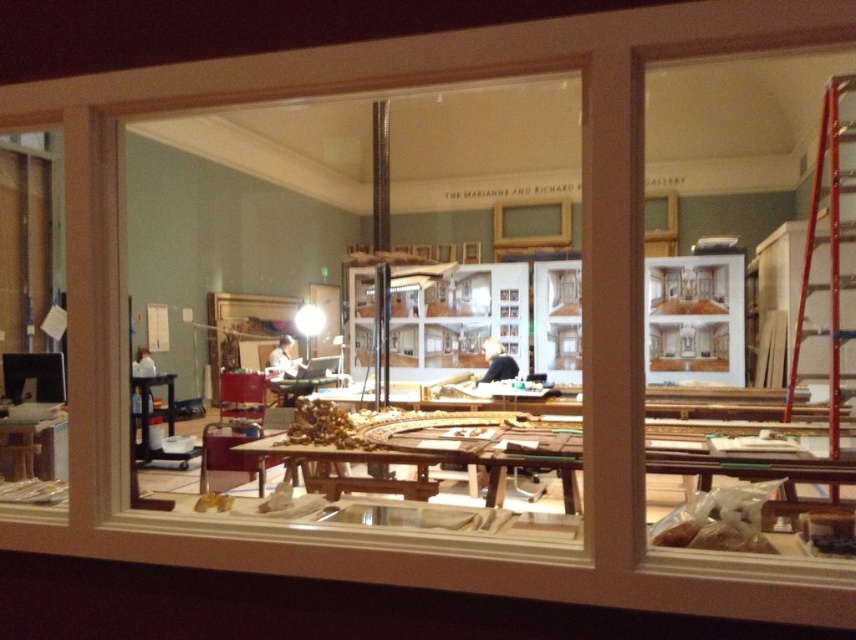
Does red metal ladder at right appear over black fabric at center?

Indeed, red metal ladder at right is positioned over black fabric at center.

Between point (843, 227) and point (490, 358), which one is positioned behind?

Positioned behind is point (490, 358).

Does point (831, 353) come closer to viewer compared to point (491, 372)?

That is True.

Identify the location of red metal ladder at right. The width and height of the screenshot is (856, 640). (828, 244).